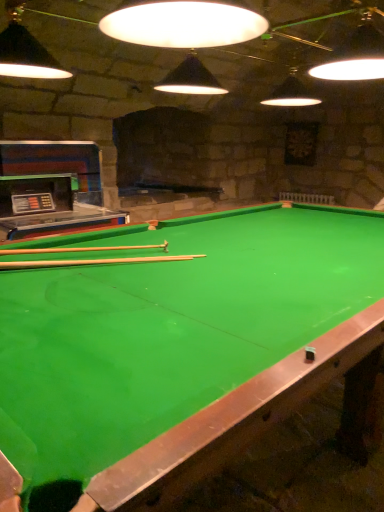
Where is `wooden cue at center, which is the first cue from top to bottom`? wooden cue at center, which is the first cue from top to bottom is located at coordinates tap(79, 249).

Where is `green felt billiard table at center`? green felt billiard table at center is located at coordinates (180, 349).

Which object is wider, wooden cue at center, which is the second cue in top-to-bottom order, or green felt billiard table at center?

Wider between the two is green felt billiard table at center.

Who is more distant, wooden cue at center, arranged as the 1th cue when ordered from the bottom, or green felt billiard table at center?

wooden cue at center, arranged as the 1th cue when ordered from the bottom, is further away from the camera.

Is wooden cue at center, arranged as the 1th cue when ordered from the bottom, facing towards green felt billiard table at center?

Yes, wooden cue at center, arranged as the 1th cue when ordered from the bottom, is aimed at green felt billiard table at center.

Is wooden cue at center, arranged as the 1th cue when ordered from the bottom, turned away from wooden cue at center, positioned as the second cue in bottom-to-top order?

No.

Which point is more forward, (144, 257) or (75, 250)?

The point (144, 257) is closer to the camera.

Who is smaller, wooden cue at center, arranged as the 1th cue when ordered from the bottom, or wooden cue at center, positioned as the second cue in bottom-to-top order?

Smaller between the two is wooden cue at center, arranged as the 1th cue when ordered from the bottom.

Is green felt billiard table at center oriented away from wooden cue at center, which is the second cue in top-to-bottom order?

green felt billiard table at center is not turned away from wooden cue at center, which is the second cue in top-to-bottom order.

Visually, is green felt billiard table at center positioned to the left or to the right of wooden cue at center, which is the second cue in top-to-bottom order?

Clearly, green felt billiard table at center is on the right of wooden cue at center, which is the second cue in top-to-bottom order, in the image.

Is green felt billiard table at center bigger or smaller than wooden cue at center, which is the second cue in top-to-bottom order?

In the image, green felt billiard table at center appears to be larger than wooden cue at center, which is the second cue in top-to-bottom order.

Looking at their sizes, would you say green felt billiard table at center is wider or thinner than wooden cue at center, which is the second cue in top-to-bottom order?

green felt billiard table at center is wider than wooden cue at center, which is the second cue in top-to-bottom order.

Which object is wider, wooden cue at center, which is the first cue from top to bottom, or green felt billiard table at center?

green felt billiard table at center.

Which is in front, wooden cue at center, positioned as the second cue in bottom-to-top order, or green felt billiard table at center?

green felt billiard table at center is in front.

Is wooden cue at center, which is the first cue from top to bottom, spatially inside green felt billiard table at center, or outside of it?

The correct answer is: inside.

From their relative heights in the image, would you say wooden cue at center, which is the first cue from top to bottom, is taller or shorter than green felt billiard table at center?

Considering their sizes, wooden cue at center, which is the first cue from top to bottom, has less height than green felt billiard table at center.

Is wooden cue at center, positioned as the second cue in bottom-to-top order, a part of green felt billiard table at center?

Absolutely, wooden cue at center, positioned as the second cue in bottom-to-top order, is inside green felt billiard table at center.

Does green felt billiard table at center touch wooden cue at center, positioned as the second cue in bottom-to-top order?

green felt billiard table at center is not next to wooden cue at center, positioned as the second cue in bottom-to-top order, and they're not touching.

Is green felt billiard table at center looking in the opposite direction of wooden cue at center, positioned as the second cue in bottom-to-top order?

green felt billiard table at center is not turned away from wooden cue at center, positioned as the second cue in bottom-to-top order.

How many degrees apart are the facing directions of green felt billiard table at center and wooden cue at center, positioned as the second cue in bottom-to-top order?

They differ by 62.5 degrees in their facing directions.

Could you tell me if wooden cue at center, positioned as the second cue in bottom-to-top order, is facing wooden cue at center, which is the second cue in top-to-bottom order?

No, wooden cue at center, positioned as the second cue in bottom-to-top order, is not facing towards wooden cue at center, which is the second cue in top-to-bottom order.

Is wooden cue at center, positioned as the second cue in bottom-to-top order, to the right of wooden cue at center, which is the second cue in top-to-bottom order, from the viewer's perspective?

No.

Is wooden cue at center, which is the first cue from top to bottom, taller or shorter than wooden cue at center, which is the second cue in top-to-bottom order?

wooden cue at center, which is the first cue from top to bottom, is taller than wooden cue at center, which is the second cue in top-to-bottom order.

How different are the orientations of wooden cue at center, positioned as the second cue in bottom-to-top order, and wooden cue at center, arranged as the 1th cue when ordered from the bottom, in degrees?

2.21 degrees separate the facing orientations of wooden cue at center, positioned as the second cue in bottom-to-top order, and wooden cue at center, arranged as the 1th cue when ordered from the bottom.

This screenshot has width=384, height=512. I want to click on billiard table in front of the wooden cue at center, arranged as the 1th cue when ordered from the bottom, so click(180, 349).

Locate an element on the screen. cue on the left of wooden cue at center, which is the second cue in top-to-bottom order is located at coordinates (79, 249).

When comparing their distances from wooden cue at center, positioned as the second cue in bottom-to-top order, does green felt billiard table at center or wooden cue at center, which is the second cue in top-to-bottom order, seem closer?

Based on the image, wooden cue at center, which is the second cue in top-to-bottom order, appears to be nearer to wooden cue at center, positioned as the second cue in bottom-to-top order.

When comparing their distances from wooden cue at center, arranged as the 1th cue when ordered from the bottom, does wooden cue at center, positioned as the second cue in bottom-to-top order, or green felt billiard table at center seem further?

green felt billiard table at center.

Which object lies further to the anchor point green felt billiard table at center, wooden cue at center, positioned as the second cue in bottom-to-top order, or wooden cue at center, which is the second cue in top-to-bottom order?

wooden cue at center, positioned as the second cue in bottom-to-top order, lies further to green felt billiard table at center than the other object.

When comparing their distances from wooden cue at center, which is the first cue from top to bottom, does wooden cue at center, arranged as the 1th cue when ordered from the bottom, or green felt billiard table at center seem further?

Among the two, green felt billiard table at center is located further to wooden cue at center, which is the first cue from top to bottom.

Looking at this image, estimate the real-world distances between objects in this image. Which object is further from wooden cue at center, arranged as the 1th cue when ordered from the bottom, green felt billiard table at center or wooden cue at center, positioned as the second cue in bottom-to-top order?

green felt billiard table at center.

Estimate the real-world distances between objects in this image. Which object is closer to green felt billiard table at center, wooden cue at center, which is the second cue in top-to-bottom order, or wooden cue at center, which is the first cue from top to bottom?

The object closer to green felt billiard table at center is wooden cue at center, which is the second cue in top-to-bottom order.

Where is `cue between green felt billiard table at center and wooden cue at center, positioned as the second cue in bottom-to-top order, along the z-axis`? The width and height of the screenshot is (384, 512). cue between green felt billiard table at center and wooden cue at center, positioned as the second cue in bottom-to-top order, along the z-axis is located at coordinates (93, 262).